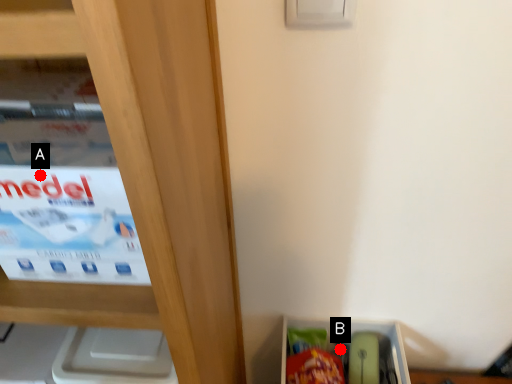
Question: Two points are circled on the image, labeled by A and B beside each circle. Which point is farther to the camera?

Choices:
 (A) A is further
 (B) B is further

Answer: (B)